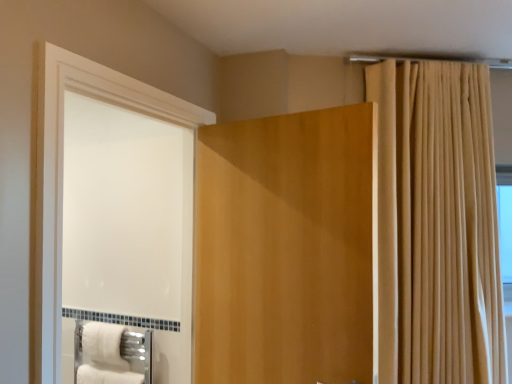
Question: From a real-world perspective, is white fluffy bath towel at lower left on top of beige fabric curtain at upper right?

Choices:
 (A) yes
 (B) no

Answer: (B)

Question: Is the position of white fluffy bath towel at lower left more distant than that of beige fabric curtain at upper right?

Choices:
 (A) no
 (B) yes

Answer: (B)

Question: Is white fluffy bath towel at lower left facing towards beige fabric curtain at upper right?

Choices:
 (A) no
 (B) yes

Answer: (A)

Question: From a real-world perspective, does white fluffy bath towel at lower left sit lower than beige fabric curtain at upper right?

Choices:
 (A) yes
 (B) no

Answer: (A)

Question: Can you confirm if white fluffy bath towel at lower left is bigger than beige fabric curtain at upper right?

Choices:
 (A) yes
 (B) no

Answer: (B)

Question: Considering the relative positions of white fluffy bath towel at lower left and beige fabric curtain at upper right in the image provided, is white fluffy bath towel at lower left to the left or to the right of beige fabric curtain at upper right?

Choices:
 (A) left
 (B) right

Answer: (A)

Question: Considering the positions of white fluffy bath towel at lower left and beige fabric curtain at upper right in the image, is white fluffy bath towel at lower left taller or shorter than beige fabric curtain at upper right?

Choices:
 (A) short
 (B) tall

Answer: (A)

Question: Looking at the image, does white fluffy bath towel at lower left seem bigger or smaller compared to beige fabric curtain at upper right?

Choices:
 (A) big
 (B) small

Answer: (B)

Question: Would you say white fluffy bath towel at lower left is inside or outside beige fabric curtain at upper right?

Choices:
 (A) inside
 (B) outside

Answer: (B)

Question: Is point (267, 362) closer or farther from the camera than point (91, 326)?

Choices:
 (A) closer
 (B) farther

Answer: (A)

Question: In terms of height, does matte wood door at center look taller or shorter compared to white fluffy bath towel at lower left?

Choices:
 (A) tall
 (B) short

Answer: (A)

Question: In terms of width, does matte wood door at center look wider or thinner when compared to white fluffy bath towel at lower left?

Choices:
 (A) thin
 (B) wide

Answer: (B)

Question: In the image, is matte wood door at center on the left side or the right side of white fluffy bath towel at lower left?

Choices:
 (A) right
 (B) left

Answer: (A)

Question: Is point (212, 188) closer or farther from the camera than point (449, 208)?

Choices:
 (A) farther
 (B) closer

Answer: (B)

Question: In terms of width, does matte wood door at center look wider or thinner when compared to beige fabric curtain at upper right?

Choices:
 (A) wide
 (B) thin

Answer: (B)